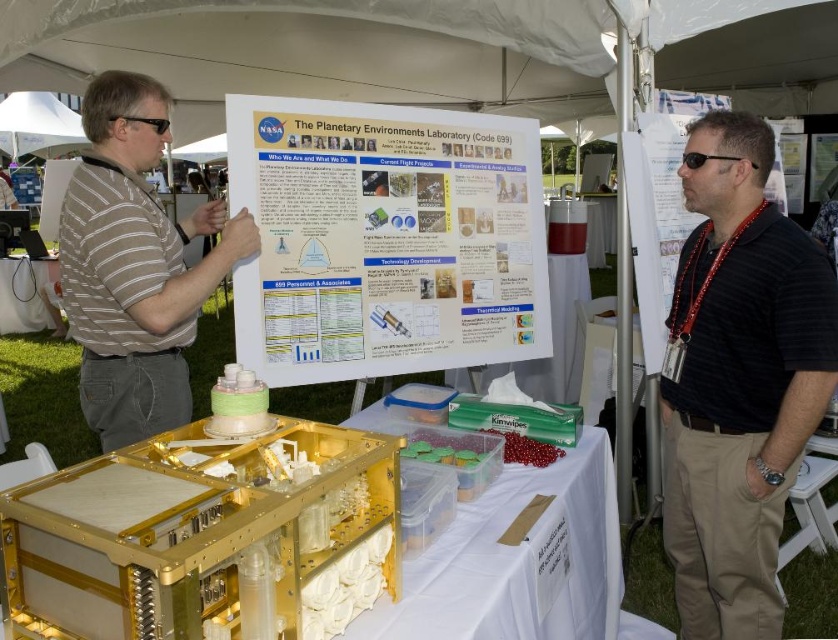
Question: Which point is closer to the camera?

Choices:
 (A) black striped shirt at center
 (B) red glossy beads at center
 (C) striped cotton shirt at left
 (D) white paper at center

Answer: (A)

Question: Which point is closer to the camera?

Choices:
 (A) red glossy beads at center
 (B) striped cotton shirt at left
 (C) black striped shirt at center

Answer: (C)

Question: Which object is farther from the camera taking this photo?

Choices:
 (A) black striped shirt at center
 (B) striped cotton shirt at left

Answer: (B)

Question: Does white paper at center have a greater width compared to red glossy beads at center?

Choices:
 (A) no
 (B) yes

Answer: (B)

Question: Is striped cotton shirt at left further to the viewer compared to red glossy beads at center?

Choices:
 (A) yes
 (B) no

Answer: (B)

Question: Can you confirm if black striped shirt at center is positioned to the right of green frosted cupcake at center?

Choices:
 (A) no
 (B) yes

Answer: (B)